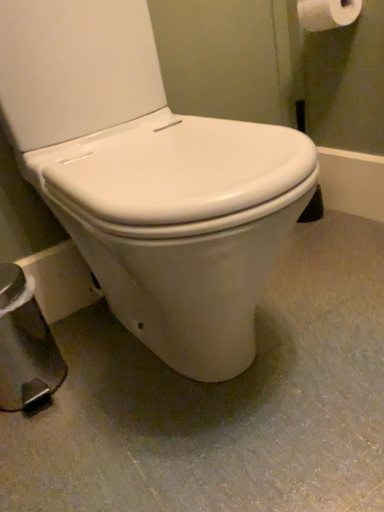
Question: Considering the positions of white smooth toilet at center and white glossy toilet at center in the image, is white smooth toilet at center wider or thinner than white glossy toilet at center?

Choices:
 (A) thin
 (B) wide

Answer: (B)

Question: Visually, is white smooth toilet at center positioned to the left or to the right of white glossy toilet at center?

Choices:
 (A) left
 (B) right

Answer: (B)

Question: Which is farther from the white glossy toilet at center?

Choices:
 (A) white smooth toilet at center
 (B) white matte toilet paper at upper right

Answer: (B)

Question: Which is nearer to the white matte toilet paper at upper right?

Choices:
 (A) white glossy toilet at center
 (B) white smooth toilet at center

Answer: (A)